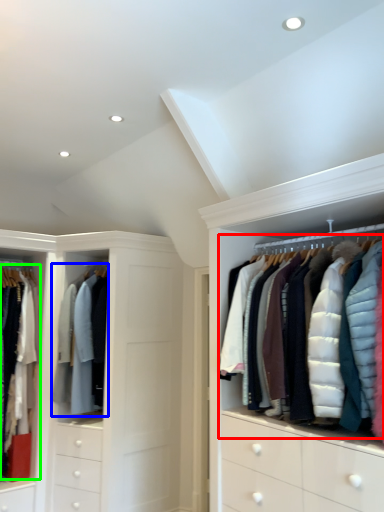
Question: Which object is the closest to the garment (highlighted by a red box)? Choose among these: clothing (highlighted by a blue box) or clothing (highlighted by a green box).

Choices:
 (A) clothing
 (B) clothing

Answer: (A)